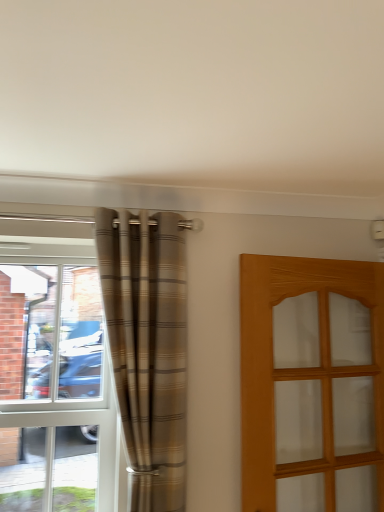
Question: Based on their sizes in the image, would you say clear glass window at left is bigger or smaller than light brown wooden door at right?

Choices:
 (A) small
 (B) big

Answer: (A)

Question: Visually, is clear glass window at left positioned to the left or to the right of light brown wooden door at right?

Choices:
 (A) right
 (B) left

Answer: (B)

Question: Considering the real-world distances, which object is closest to the light brown wooden door at right?

Choices:
 (A) plaid fabric curtain at left
 (B) clear glass window at left

Answer: (A)

Question: Based on their relative distances, which object is nearer to the clear glass window at left?

Choices:
 (A) plaid fabric curtain at left
 (B) light brown wooden door at right

Answer: (A)